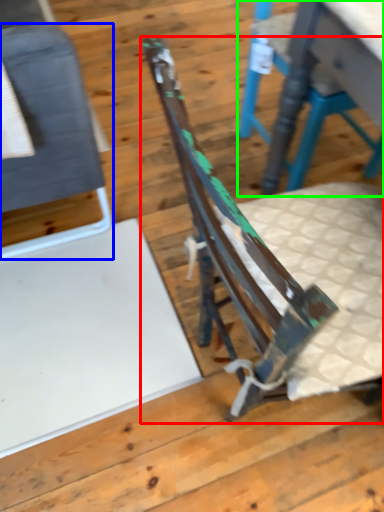
Question: Considering the real-world distances, which object is closest to chair (highlighted by a red box)? chair (highlighted by a blue box) or chair (highlighted by a green box).

Choices:
 (A) chair
 (B) chair

Answer: (A)